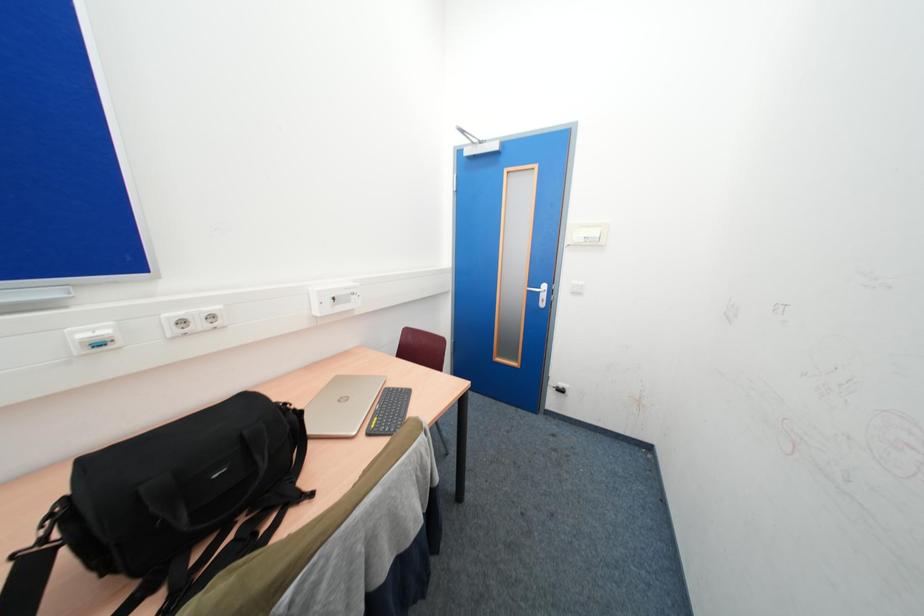
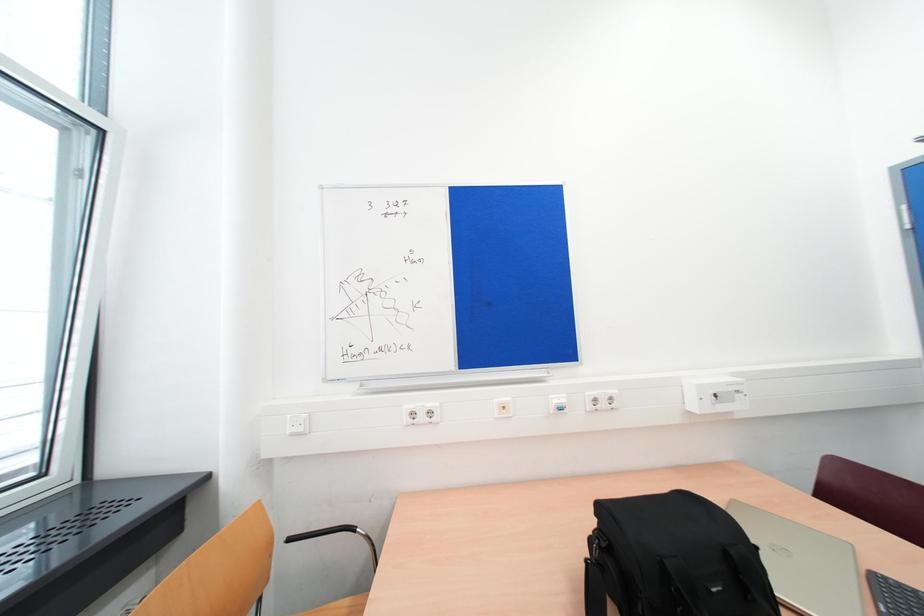
Question: The images are taken continuously from a first-person perspective. In which direction is your viewpoint rotating?

Choices:
 (A) Left
 (B) Right
 (C) Up
 (D) Down

Answer: (A)